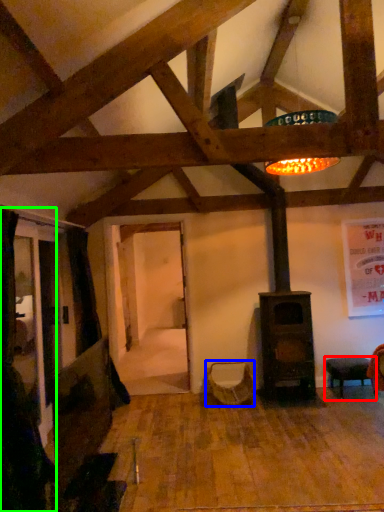
Question: Considering the real-world distances, which object is farthest from furniture (highlighted by a red box)? swivel chair (highlighted by a blue box) or curtain (highlighted by a green box)?

Choices:
 (A) swivel chair
 (B) curtain

Answer: (B)